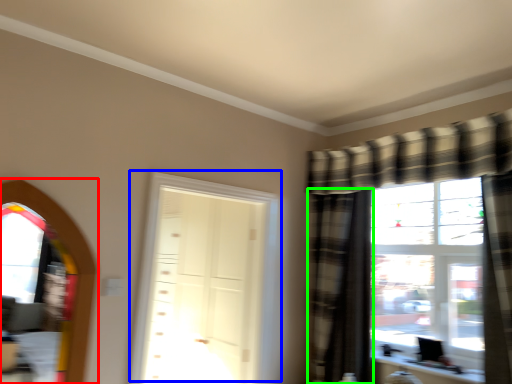
Question: Which object is positioned closest to window screen (highlighted by a red box)? Select from door (highlighted by a blue box) and curtain (highlighted by a green box).

Choices:
 (A) door
 (B) curtain

Answer: (A)